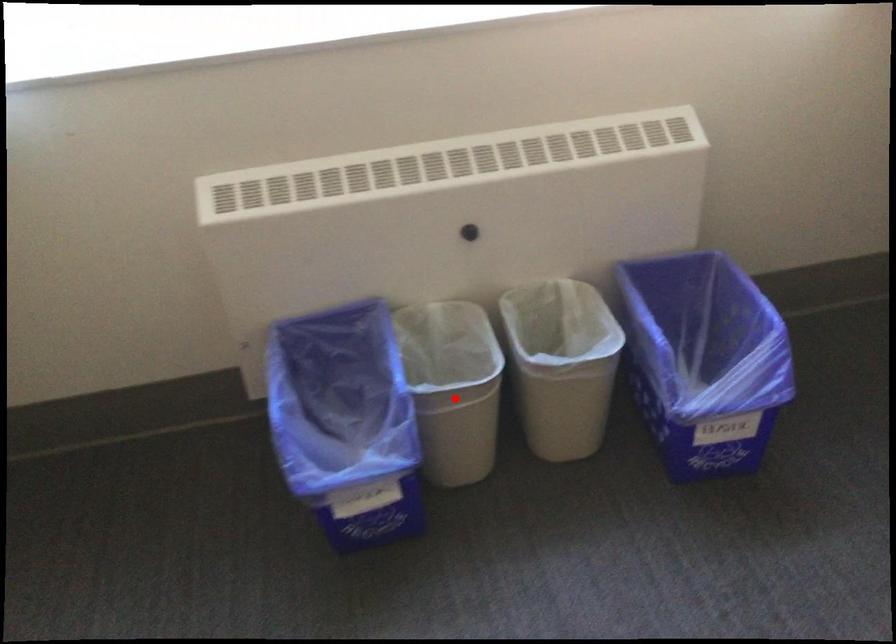
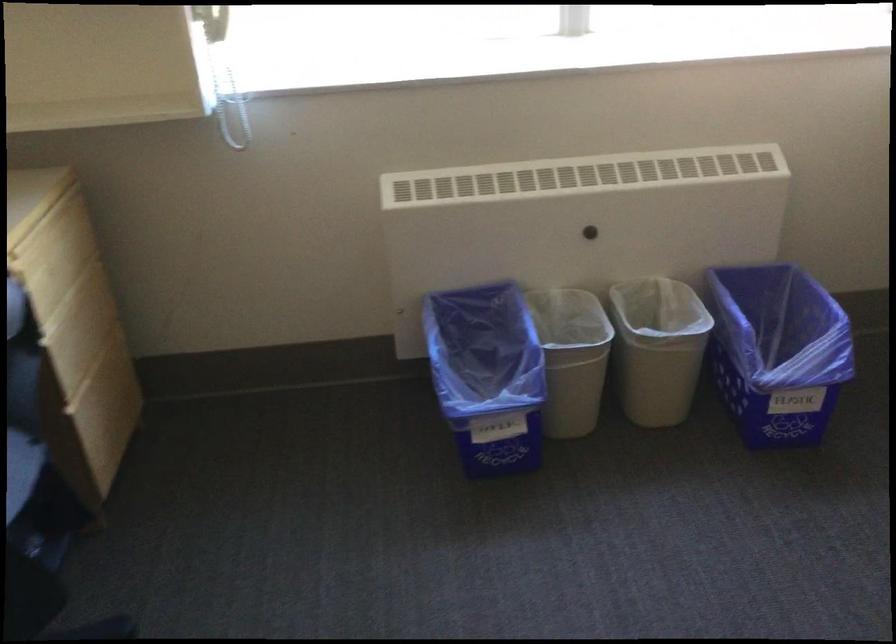
Question: I am providing you with two images of the same scene from different viewpoints. In image1, a red point is highlighted. Considering the same 3D point in image2, which of the following is correct?

Choices:
 (A) It is closer
 (B) It is farther

Answer: (B)